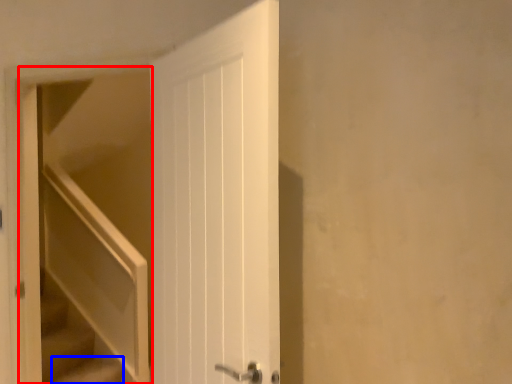
Question: Which object appears closest to the camera in this image, elevator (highlighted by a red box) or stairs (highlighted by a blue box)?

Choices:
 (A) elevator
 (B) stairs

Answer: (A)